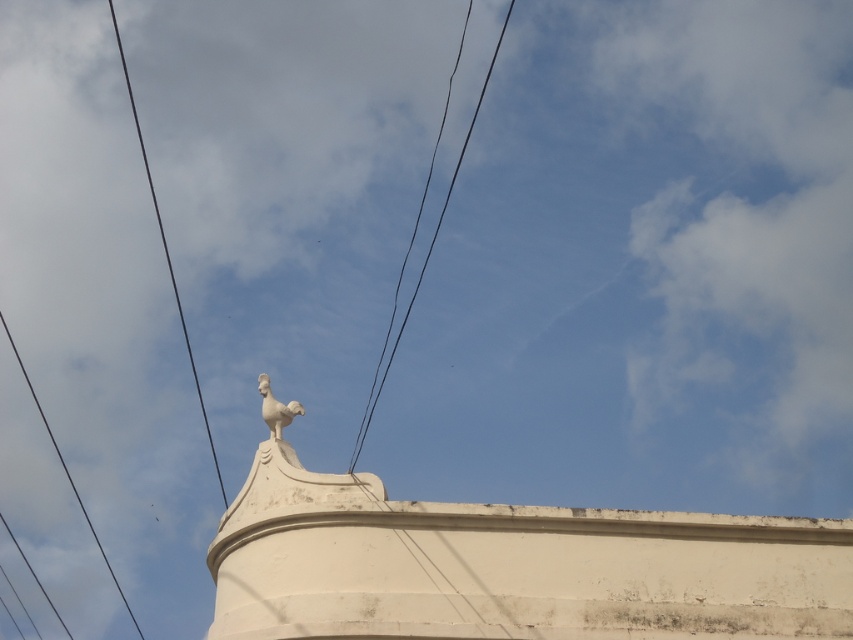
You are a bird trying to land on the highest point between the black wire at left and the white stone rooster at upper center. Which one should you choose?

The black wire at left is taller than the white stone rooster at upper center, so you should choose the black wire at left to land on the highest point.

You are a bird looking for a place to land. You see the black wire at left and the white stone rooster at upper center. Which object is closer to you for landing?

The black wire at left is closer to you than the white stone rooster at upper center, so you should land on the black wire at left.

You are a bird looking for a place to land on the roof. You see two black wires, the black wire at left and the black wire at center. Which wire is narrower?

The black wire at left is narrower than the black wire at center because it occupies less space.